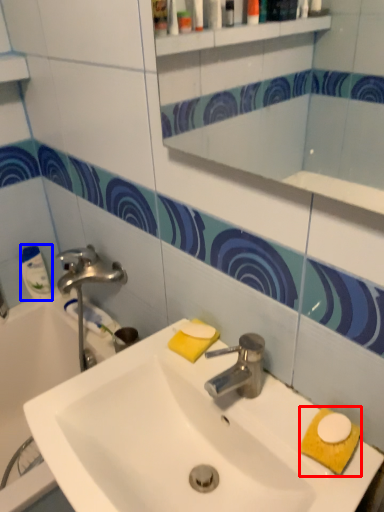
Question: Which point is further to the camera, hand towel (highlighted by a red box) or cleaning product (highlighted by a blue box)?

Choices:
 (A) hand towel
 (B) cleaning product

Answer: (B)